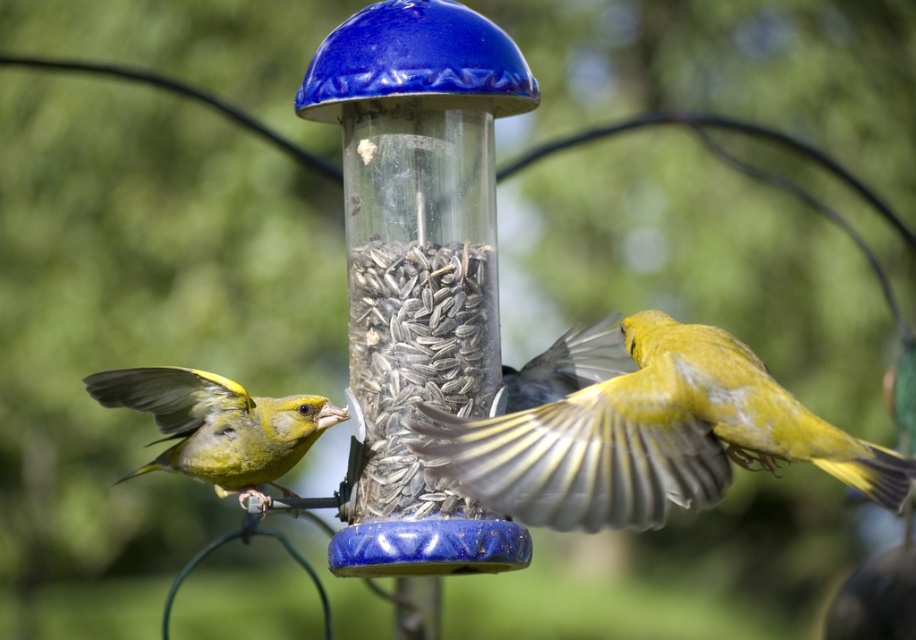
Question: Is gray textured seeds at center below green matte bird at left?

Choices:
 (A) yes
 (B) no

Answer: (B)

Question: Does gray textured seeds at center appear on the right side of green matte bird at left?

Choices:
 (A) yes
 (B) no

Answer: (A)

Question: Among these objects, which one is farthest from the camera?

Choices:
 (A) yellow feathered bird at center
 (B) transparent plastic bird feeder at center
 (C) gray textured seeds at center
 (D) green matte bird at left

Answer: (D)

Question: Is yellow feathered bird at center positioned in front of gray textured seeds at center?

Choices:
 (A) yes
 (B) no

Answer: (A)

Question: Estimate the real-world distances between objects in this image. Which object is farther from the green matte bird at left?

Choices:
 (A) yellow feathered bird at center
 (B) gray textured seeds at center
 (C) transparent plastic bird feeder at center

Answer: (A)

Question: Estimate the real-world distances between objects in this image. Which object is farther from the green matte bird at left?

Choices:
 (A) transparent plastic bird feeder at center
 (B) yellow feathered bird at center

Answer: (B)